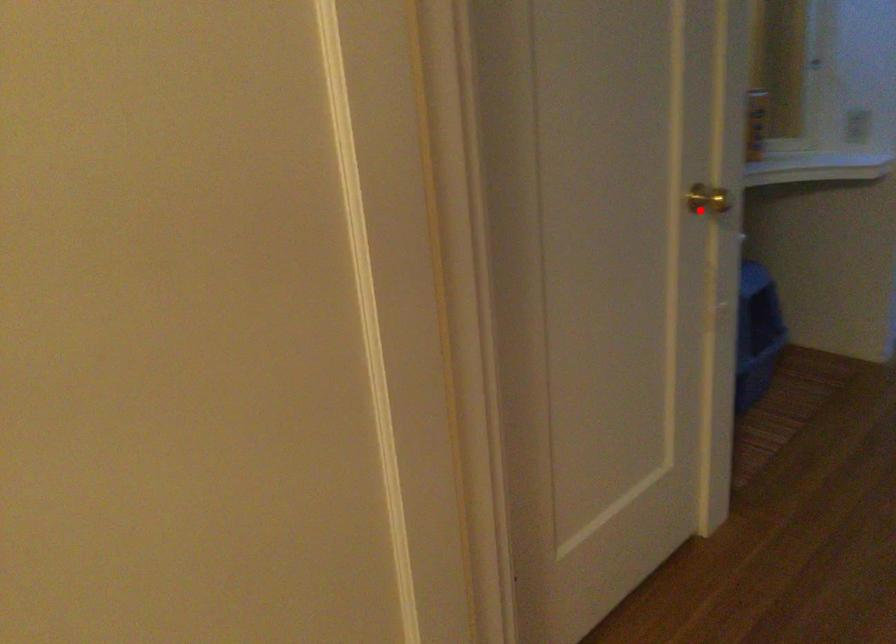
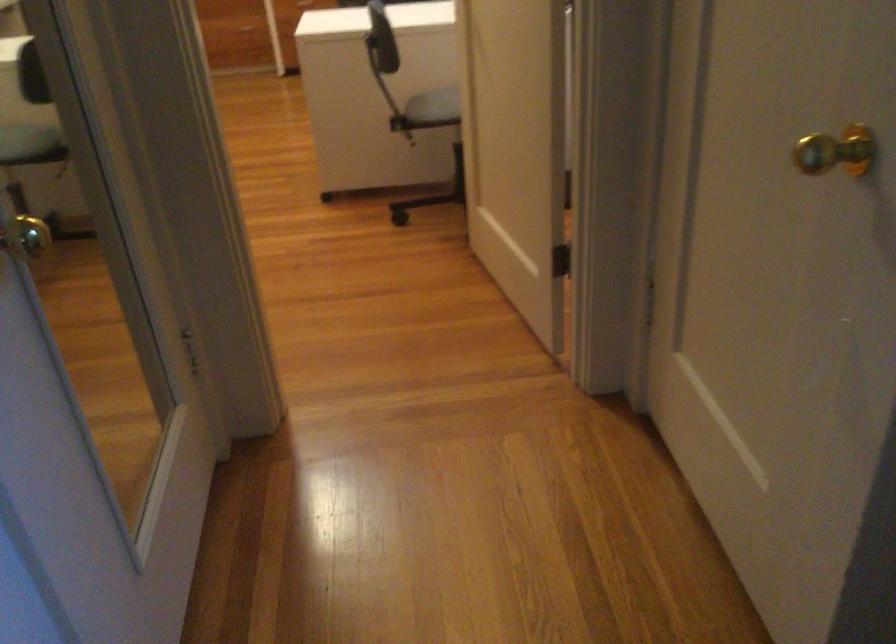
In the second image, find the point that corresponds to the highlighted location in the first image.

(836, 152)